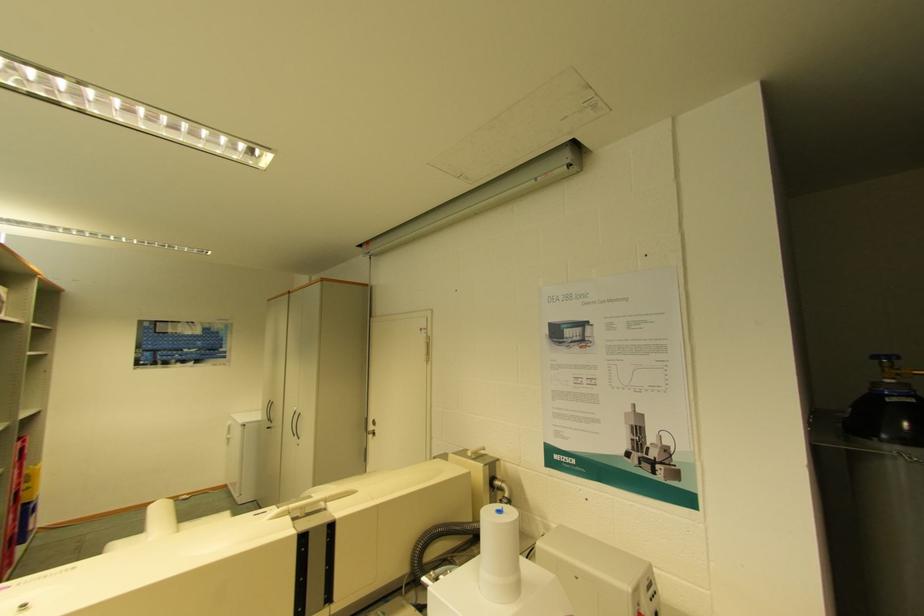
You are a GUI agent. You are given a task and a screenshot of the screen. Output one action in this format:
    pyautogui.click(x=<x>, y=<y>)
    Task: Click on the blue valve handle
    This screenshot has width=924, height=616.
    Given the screenshot: What is the action you would take?
    pyautogui.click(x=910, y=365)